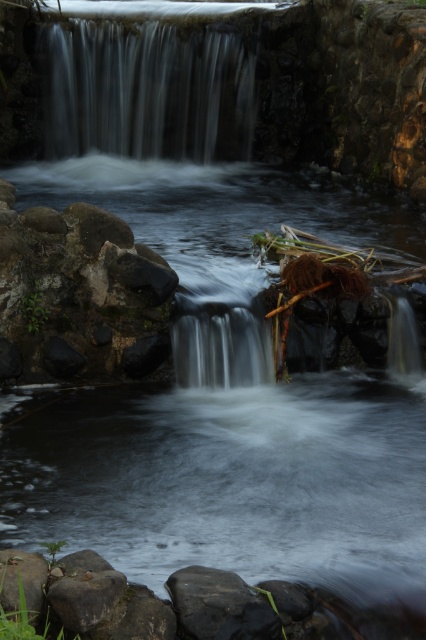
In the scene shown: Who is positioned more to the left, smooth gray water at upper center or smooth gray water at center?

smooth gray water at upper center

Does point (134, 147) come behind point (241, 353)?

Yes, it is behind point (241, 353).

Locate an element on the screen. smooth gray water at upper center is located at coordinates (149, 92).

Is smooth gray water at center to the left of smooth gray rock at lower left from the viewer's perspective?

No, smooth gray water at center is not to the left of smooth gray rock at lower left.

Is smooth gray water at center below smooth gray rock at lower left?

No.

Image resolution: width=426 pixels, height=640 pixels. What do you see at coordinates (219, 348) in the screenshot?
I see `smooth gray water at center` at bounding box center [219, 348].

What are the coordinates of `smooth gray water at center` in the screenshot? It's located at (219, 348).

Is smooth gray water at upper center above smooth gray rock at lower left?

Yes, smooth gray water at upper center is above smooth gray rock at lower left.

Can you confirm if smooth gray water at upper center is positioned to the right of smooth gray rock at lower left?

Incorrect, smooth gray water at upper center is not on the right side of smooth gray rock at lower left.

Does point (190, 33) lie in front of point (20, 576)?

No, (190, 33) is further to viewer.

The height and width of the screenshot is (640, 426). Identify the location of smooth gray water at upper center. (149, 92).